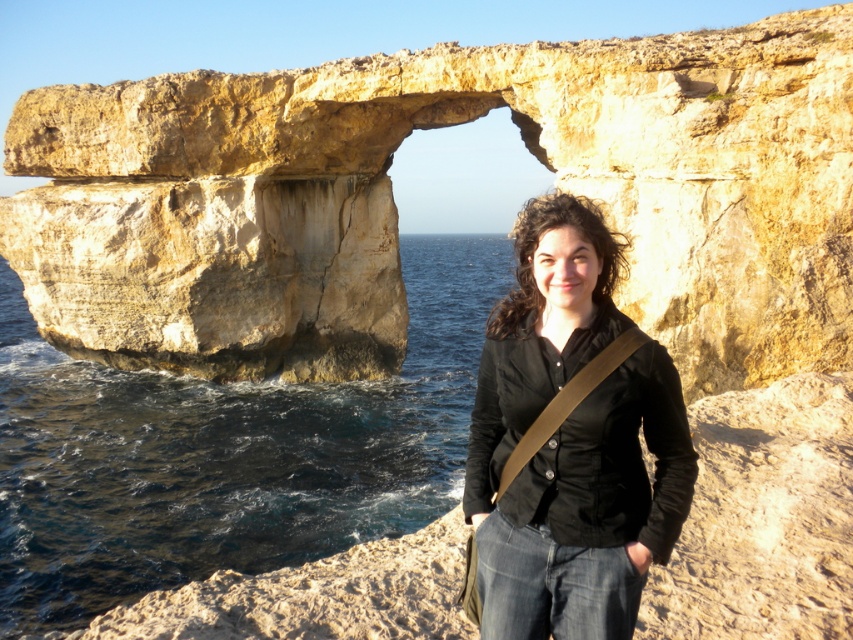
You are a photographer planning to take a photo of the yellowish stone arch at center and the matte black shirt at center. If your camera can only capture objects that are at least 2 meters wide, will both objects fit within the frame?

The yellowish stone arch at center has a width larger than the matte black shirt at center. Since the camera requires objects to be at least 2 meters wide, the yellowish stone arch at center likely meets the requirement, but the matte black shirt at center may not. However, without knowing the exact width of the shirt, we cannot confirm if both will fit.

You are a photographer planning to capture the yellowish stone arch at center and the smooth rock coast at lower center in a single frame. Based on their sizes, which object should you focus on to ensure both are visible without cropping?

The yellowish stone arch at center is larger in size than the smooth rock coast at lower center, so you should focus on the yellowish stone arch at center to ensure both are visible without cropping.